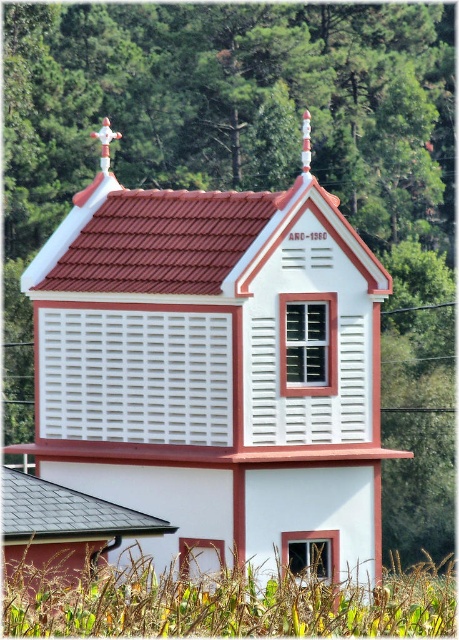
Who is more distant from viewer, (x=185, y=560) or (x=59, y=513)?

The point (x=185, y=560) is behind.

Does point (347, 564) come farther from viewer compared to point (1, 484)?

Yes, it is behind point (1, 484).

Is point (135, 260) in front of point (70, 499)?

That is False.

At what (x,y) coordinates should I click in order to perform the action: click on white louvered chapel at center. Please return your answer as a coordinate pair (x, y). This screenshot has width=459, height=640. Looking at the image, I should click on (216, 369).